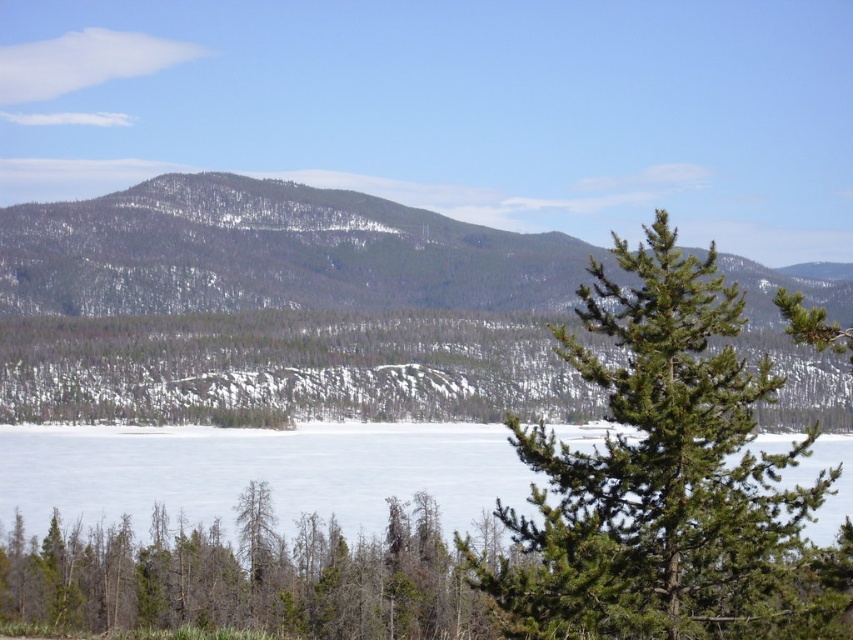
Question: Can you confirm if snow-covered mountain at center is positioned to the right of brown/dried wood trees at lower center?

Choices:
 (A) yes
 (B) no

Answer: (A)

Question: Among these points, which one is farthest from the camera?

Choices:
 (A) (55, 506)
 (B) (274, 264)
 (C) (641, 394)
 (D) (187, 547)

Answer: (B)

Question: Among these points, which one is nearest to the camera?

Choices:
 (A) (7, 216)
 (B) (320, 451)

Answer: (B)

Question: Which object appears farthest from the camera in this image?

Choices:
 (A) green needle-like tree at center
 (B) snow-covered mountain at center

Answer: (B)

Question: Is snow-covered mountain at center positioned at the back of brown/dried wood trees at lower center?

Choices:
 (A) no
 (B) yes

Answer: (B)

Question: Can you confirm if snow-covered mountain at center is positioned above brown/dried wood trees at lower center?

Choices:
 (A) no
 (B) yes

Answer: (B)